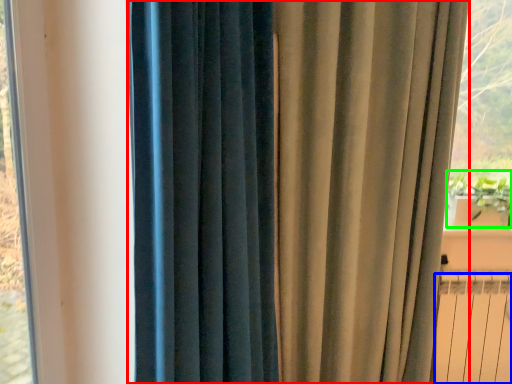
Question: Which is nearer to the curtain (highlighted by a red box)? radiator (highlighted by a blue box) or plant (highlighted by a green box).

Choices:
 (A) radiator
 (B) plant

Answer: (A)